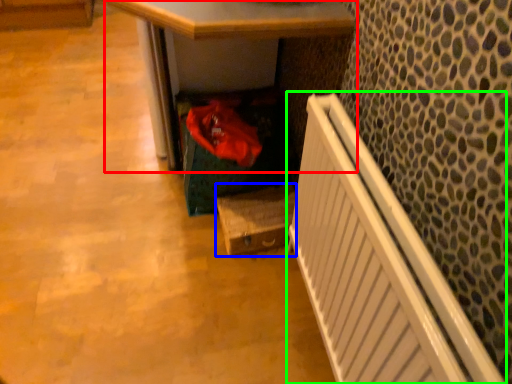
Question: Which object is positioned closest to desk (highlighted by a red box)? Select from box (highlighted by a blue box) and radiator (highlighted by a green box).

Choices:
 (A) box
 (B) radiator

Answer: (A)